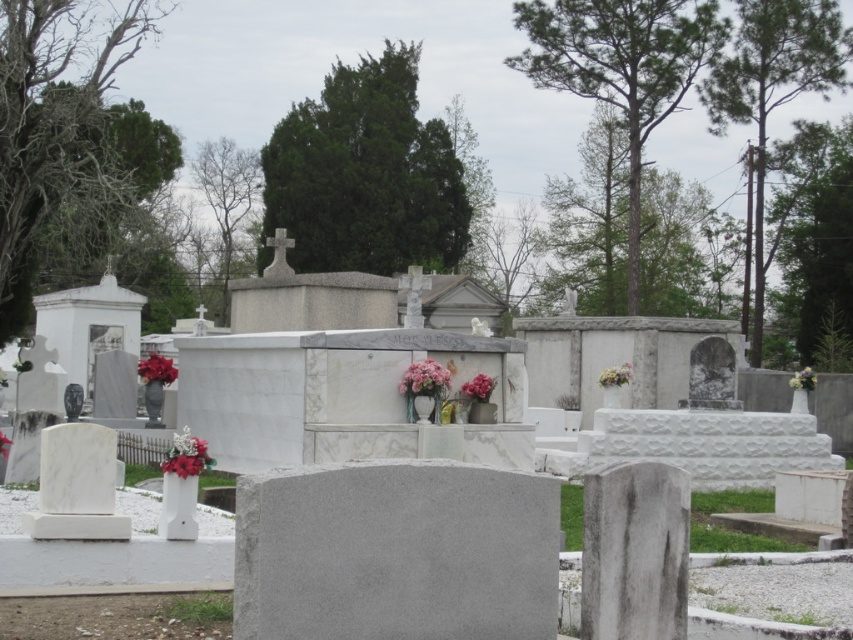
Question: Based on their relative distances, which object is farther from the pink floral bouquet at center?

Choices:
 (A) pink floral bouquet at center-right
 (B) white matte vase at center-right
 (C) red matte flower at center

Answer: (A)

Question: Which of the following is the farthest from the observer?

Choices:
 (A) matte red flowers at center-left
 (B) gray marble gravestone at center
 (C) matte floral arrangement at lower left

Answer: (A)

Question: In this image, where is matte red flowers at center-left located relative to pink fabric flowers at center?

Choices:
 (A) right
 (B) left

Answer: (B)

Question: In this image, where is pink floral bouquet at center located relative to white matte vase at center-right?

Choices:
 (A) left
 (B) right

Answer: (A)

Question: Which point is closer to the camera?

Choices:
 (A) pink fabric flowers at center
 (B) pink floral bouquet at center
 (C) matte red flowers at center-left
 (D) red matte flower at center

Answer: (D)

Question: Is matte floral arrangement at lower left wider than red matte flower at center?

Choices:
 (A) yes
 (B) no

Answer: (B)